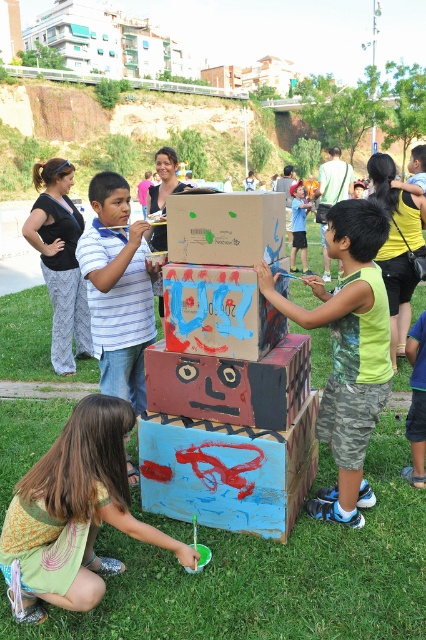
You are a photographer at the park and want to capture both the striped cotton shirt at center and the black fabric top at upper left in a single photo. Since the camera can only focus on one subject at a time, which clothing item should you focus on to ensure it appears clearer in the photo?

The striped cotton shirt at center should be focused on because it is larger in size compared to the black fabric top at upper left, making it more prominent in the frame.

You are holding a camera and want to take a photo of the matte red cardboard box at center. If you are standing 2.77 meters away from it, is that a good distance for a clear closeup shot?

The matte red cardboard box at center is 2.77 meters away from the camera. For a clear closeup shot, you need to be closer than that distance. Move closer to the box to ensure it fills the frame properly.

You are a photographer at the park and want to capture a photo of the two people wearing the green fabric dress at lower left and the striped cotton shirt at center. Since you want both to be clearly visible, which person should you focus on to ensure their clothing details are sharp?

The green fabric dress at lower left has a larger width than the striped cotton shirt at center, so focusing on the green fabric dress at lower left would ensure its details are sharp and visible in the photo.